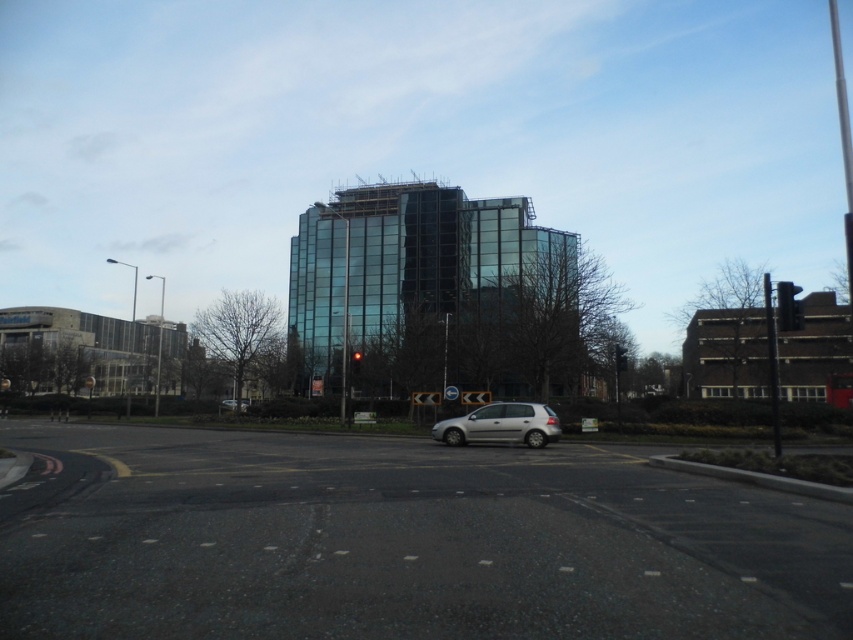
You are a delivery driver approaching the intersection with a silver metallic car at center. You need to stop at the metallic traffic light at center. Can your car fit in the space between the traffic light and the road edge without touching the light?

The metallic traffic light at center has a lesser width compared to silver metallic car at center. Since the traffic light is narrower than the car, there should be enough space for the car to pass through the area between the traffic light and the road edge without touching the light.

You are standing at the point marked as point (619,356). Which object is directly in front of you?

The metallic traffic light at center is located at point (619,356), so it is directly in front of you.

You are a delivery driver approaching the intersection. You see the silver metallic hatchback at lower center and the metallic traffic light at center. Which object is taller?

The silver metallic hatchback at lower center is much taller than the metallic traffic light at center.